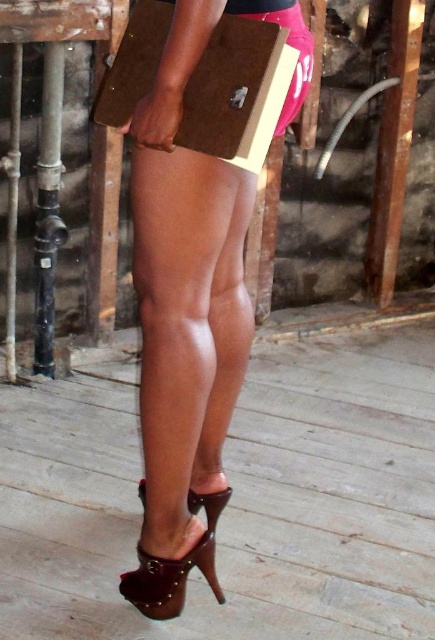
You are taking a photo of the person in the image. You want to focus on the point that is closer to the camera. Which coordinate should you choose between point (224, 138) and point (163, 570)?

Point (224, 138) is closer to the camera than point (163, 570), so you should choose point (224, 138) to focus on.

You are a fashion designer observing the outfit of the person in the image. You need to decide whether the satin brown clutch at center will fit into the pocket of the brown leather sandal at lower center. Based on their sizes, what do you think?

The satin brown clutch at center is much taller than the brown leather sandal at lower center, so it won

You are a photographer trying to capture a closeup of the folder the person is holding. You can only focus on one point at a time. Which of the two points, point (147, 556) or point (220, 496), should you choose to ensure the folder is in focus?

Point (147, 556) is closer to the viewer than point (220, 496), so focusing on point (147, 556) will ensure the folder is in focus.